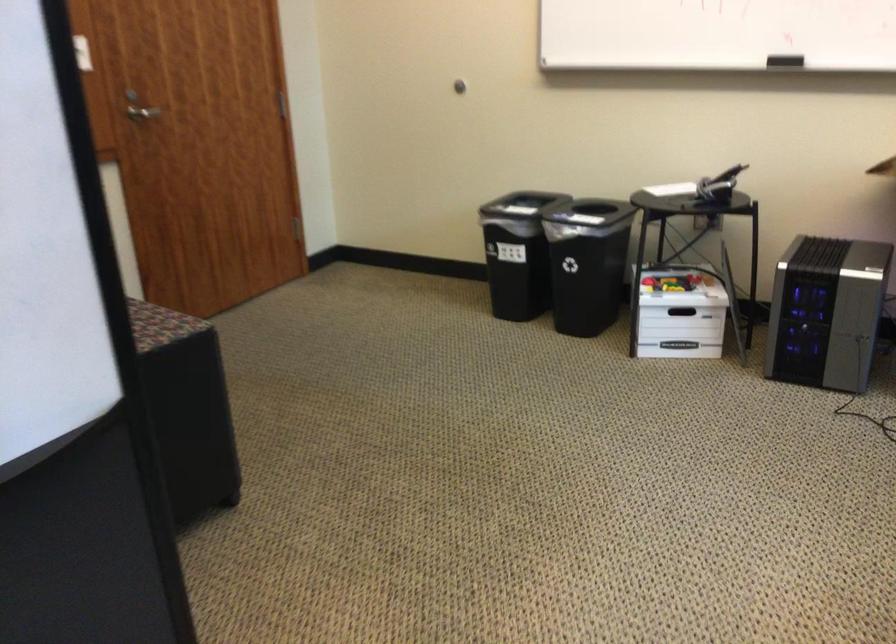
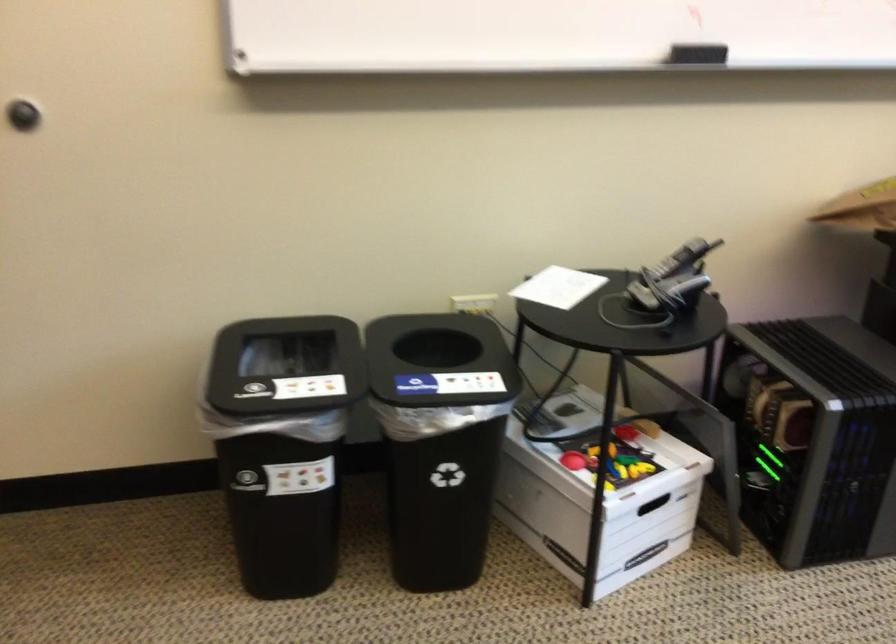
The point at (670, 190) is marked in the first image. Where is the corresponding point in the second image?

(558, 287)